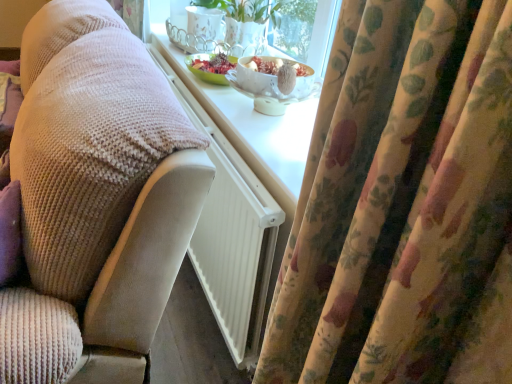
Find the location of a particular element. pink corduroy couch at left is located at coordinates (96, 199).

Describe the element at coordinates (96, 199) in the screenshot. I see `pink corduroy couch at left` at that location.

I want to click on pink corduroy couch at left, so click(x=96, y=199).